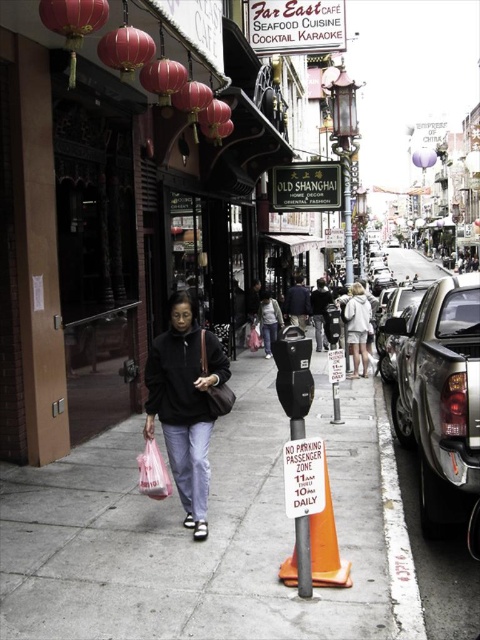
You are a pedestrian walking on the sidewalk in the Chinatown area. You see a light gray sweater at center and a brown leather handbag at center. Which item is closer to you?

The light gray sweater at center is closer to you because the brown leather handbag at center is behind it.

You are a delivery driver who needs to park your van temporarily. The parking meter is at center. The curb is at lower right. Can you park your van between the white painted curb at lower right and the black plastic parking meter at center without overlapping them?

The white painted curb at lower right might be wider than black plastic parking meter at center, so there may not be enough space to park the van between them without overlapping. Check the exact width before deciding.

You are standing at point (294, 278) and want to walk to point (332, 548). Is the destination point in front of you or behind you?

The destination point (332, 548) is in front of point (294, 278). Therefore, the destination is in front of you.